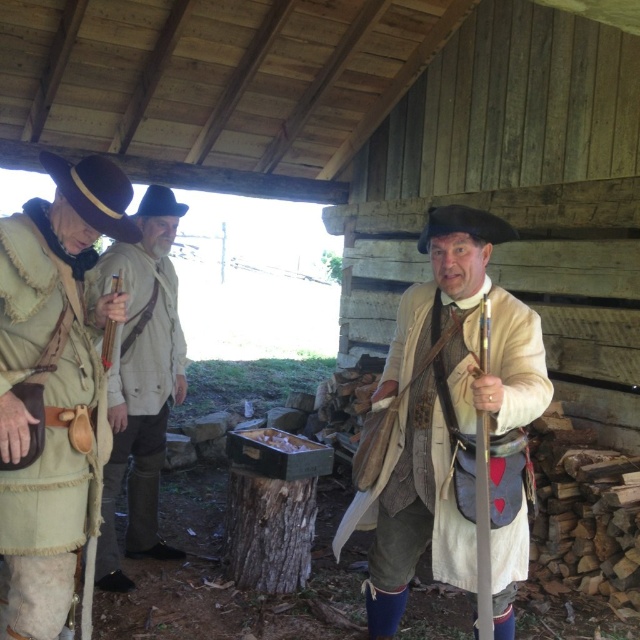
Question: Among these points, which one is farthest from the camera?

Choices:
 (A) (13, 308)
 (B) (371, 625)
 (C) (147, 211)

Answer: (C)

Question: Which object appears farthest from the camera in this image?

Choices:
 (A) light brown leather jacket at center
 (B) leather belt at left

Answer: (A)

Question: Is leather belt at left to the left of light brown leather jacket at center from the viewer's perspective?

Choices:
 (A) yes
 (B) no

Answer: (B)

Question: Which point is closer to the camera taking this photo?

Choices:
 (A) (132, 472)
 (B) (3, 300)

Answer: (B)

Question: Can you confirm if leather belt at left is wider than light brown leather jacket at center?

Choices:
 (A) no
 (B) yes

Answer: (B)

Question: Can you confirm if leather belt at left is wider than light brown leather jacket at center?

Choices:
 (A) no
 (B) yes

Answer: (B)